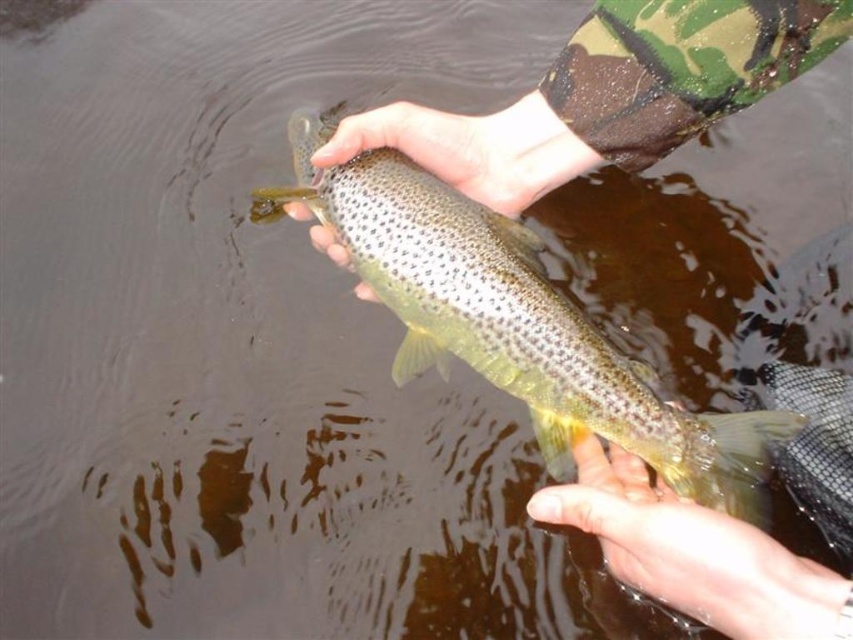
Is point (331, 182) less distant than point (373, 113)?

No, it is behind (373, 113).

Is speckled goldfish at center bigger than smooth skin hand at center?

Indeed, speckled goldfish at center has a larger size compared to smooth skin hand at center.

Between point (361, 260) and point (440, 120), which one is positioned behind?

The point (440, 120) is more distant.

The height and width of the screenshot is (640, 853). I want to click on speckled goldfish at center, so click(515, 323).

The height and width of the screenshot is (640, 853). Describe the element at coordinates (691, 552) in the screenshot. I see `smooth skin hand at lower right` at that location.

Which is behind, point (567, 488) or point (502, 193)?

Point (502, 193)

Is point (543, 500) more distant than point (393, 132)?

No, (543, 500) is in front of (393, 132).

Find the location of `smooth skin hand at lower right`. smooth skin hand at lower right is located at coordinates (691, 552).

Is speckled goldfish at center to the right of smooth skin hand at lower right from the viewer's perspective?

No, speckled goldfish at center is not to the right of smooth skin hand at lower right.

Which is more to the right, speckled goldfish at center or smooth skin hand at lower right?

smooth skin hand at lower right

Describe the element at coordinates (515, 323) in the screenshot. This screenshot has height=640, width=853. I see `speckled goldfish at center` at that location.

This screenshot has height=640, width=853. What are the coordinates of `speckled goldfish at center` in the screenshot? It's located at (515, 323).